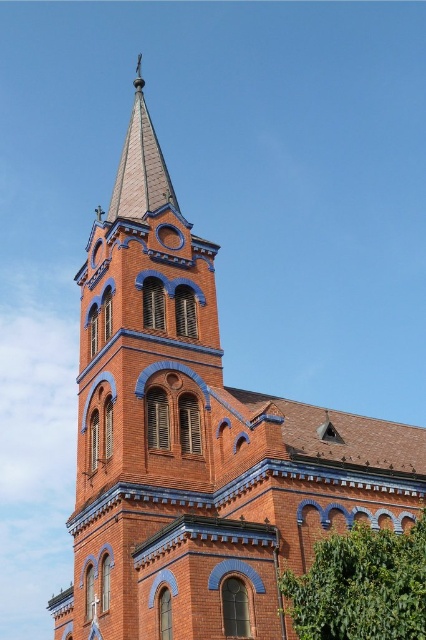
Between green leafy tree at lower right and shiny blue tile spire at upper center, which one is positioned lower?

green leafy tree at lower right is below.

Does green leafy tree at lower right have a smaller size compared to shiny blue tile spire at upper center?

Yes, green leafy tree at lower right is smaller than shiny blue tile spire at upper center.

You are a GUI agent. You are given a task and a screenshot of the screen. Output one action in this format:
    pyautogui.click(x=<x>, y=<y>)
    Task: Click on the green leafy tree at lower right
    This screenshot has height=640, width=426.
    Given the screenshot: What is the action you would take?
    pos(362,586)

Where is `green leafy tree at lower right`? This screenshot has height=640, width=426. green leafy tree at lower right is located at coordinates (362, 586).